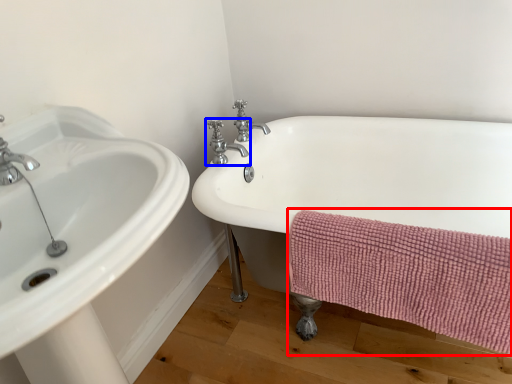
Question: Which of the following is the farthest to the observer, bath towel (highlighted by a red box) or tap (highlighted by a blue box)?

Choices:
 (A) bath towel
 (B) tap

Answer: (B)